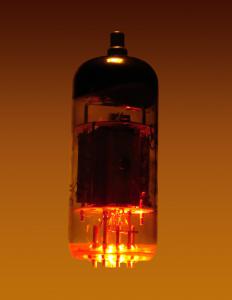
This screenshot has width=232, height=300. Identify the location of light. (113, 261), (100, 256), (124, 257).